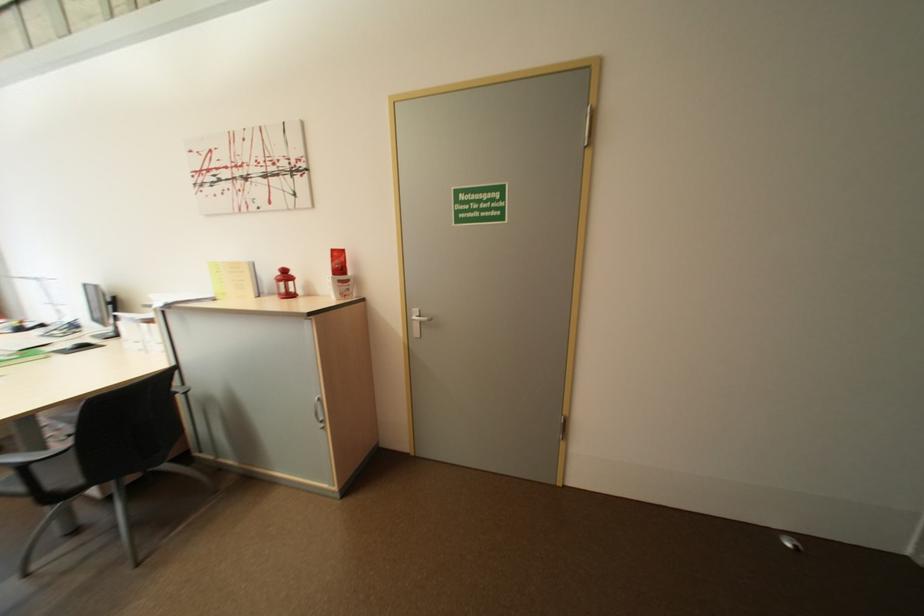
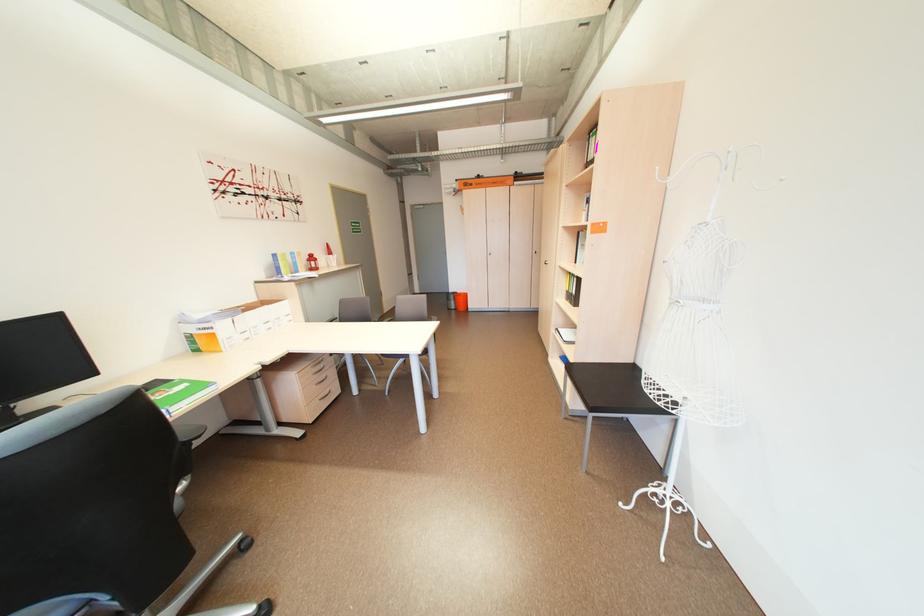
Question: I am providing you with two images of the same scene from different viewpoints. Please identify which objects are invisible in image2.

Choices:
 (A) chair armrest
 (B) orange bucket
 (C) green notebook
 (D) silver cooking pot

Answer: (A)